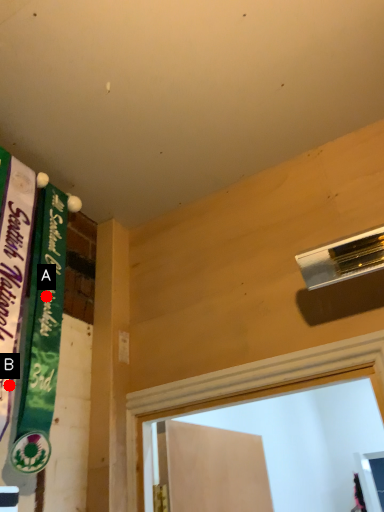
Question: Two points are circled on the image, labeled by A and B beside each circle. Which point is closer to the camera taking this photo?

Choices:
 (A) A is closer
 (B) B is closer

Answer: (B)